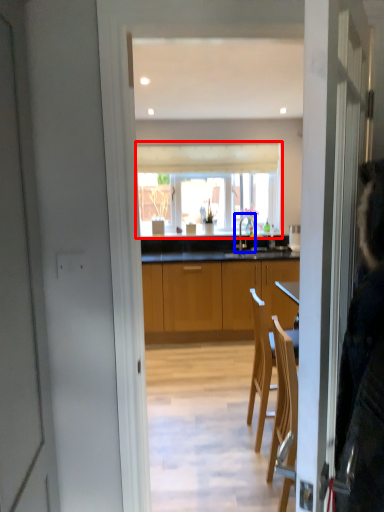
Question: Which point is closer to the camera, window (highlighted by a red box) or tap (highlighted by a blue box)?

Choices:
 (A) window
 (B) tap

Answer: (B)